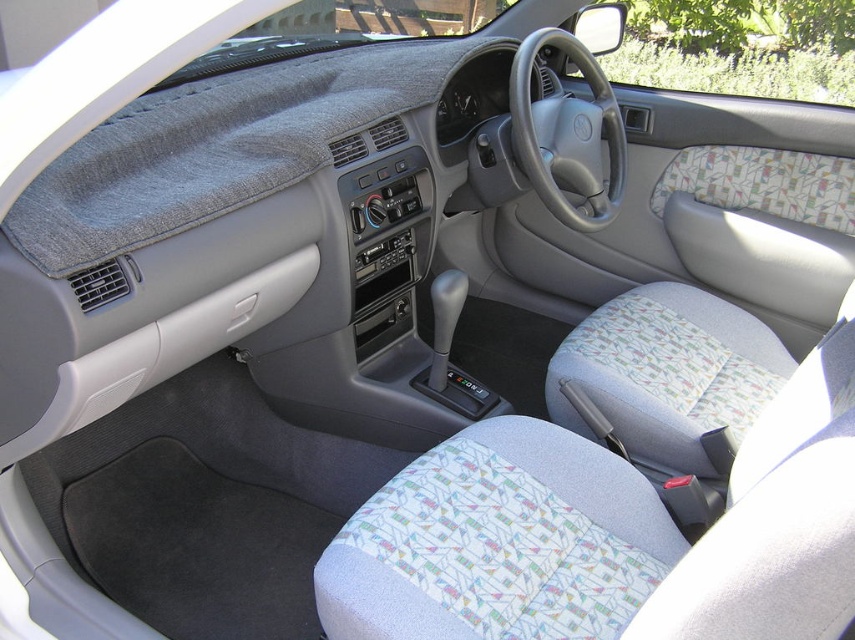
You are sitting in the driver seat of the car and want to reach two points inside the car. The first point is point (x=504, y=548) and the second point is point (x=263, y=104). Which point is closer to you?

Point (x=504, y=548) is closer to the viewer than point (x=263, y=104).

You are a car mechanic working on a Toyota vehicle. You need to install a new sensor between the textured fabric seat at center and the gray fabric dashboard cover at upper center. The sensor requires 30 inches of space. Can you fit it there?

The distance between the textured fabric seat at center and the gray fabric dashboard cover at upper center is 32.12 inches, which is more than the required 30 inches. Therefore, the sensor can be installed there with enough space.